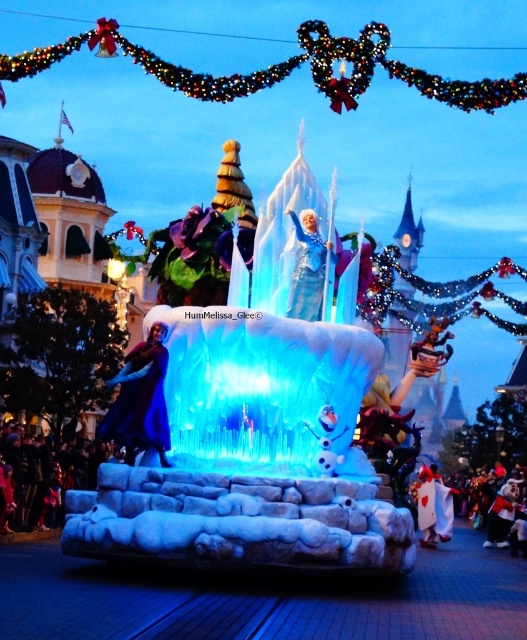
You are a costume designer trying to decide which item to display first in a showcase. The showcase has a shelf that can only accommodate items narrower than the other. Given the blue satin dress at center and the velvet plush teddy bear at lower right, which item should you choose to place on the shelf first?

The blue satin dress at center has a smaller width than the velvet plush teddy bear at lower right, so you should place the blue satin dress at center first on the shelf since it is narrower and fits the requirement.

You are a photographer at the parade and want to capture both the blue satin dress at center and the velvet plush teddy bear at lower right in a single photo. Which object should you focus on first to ensure both are in frame?

The blue satin dress at center is positioned over the velvet plush teddy bear at lower right, so you should focus on the blue satin dress at center first to ensure both are in frame.

You are a photographer trying to capture a clear shot of the matte blue gown at left during the parade. However, there is a dark blue fabric crowd at lower left blocking your view. Based on the scene description, can you determine if the crowd will completely obscure the gown?

The dark blue fabric crowd at lower left has a lesser width compared to the matte blue gown at left. This means the crowd is narrower than the gown, so it may not completely block the view of the gown. Adjust your angle slightly to ensure the narrower crowd doesn